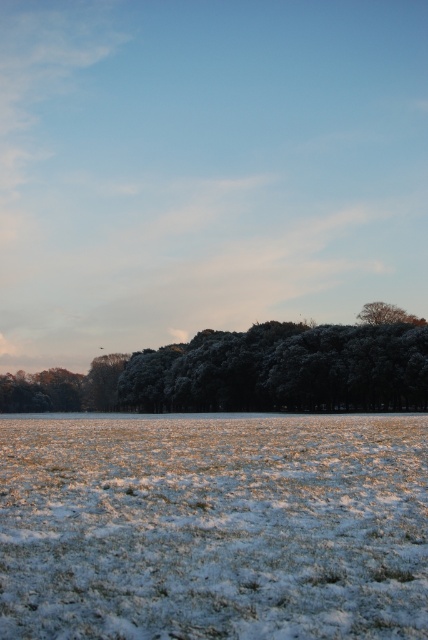
Question: Among these points, which one is farthest from the camera?

Choices:
 (A) (125, 500)
 (B) (366, 371)

Answer: (B)

Question: Which of the following is the closest to the observer?

Choices:
 (A) (175, 387)
 (B) (53, 536)

Answer: (B)

Question: Can you confirm if white frosty grass at center is smaller than frosted green trees at center?

Choices:
 (A) no
 (B) yes

Answer: (B)

Question: Is white frosty grass at center above frosted green trees at center?

Choices:
 (A) no
 (B) yes

Answer: (A)

Question: Does white frosty grass at center appear under frosted green trees at center?

Choices:
 (A) no
 (B) yes

Answer: (B)